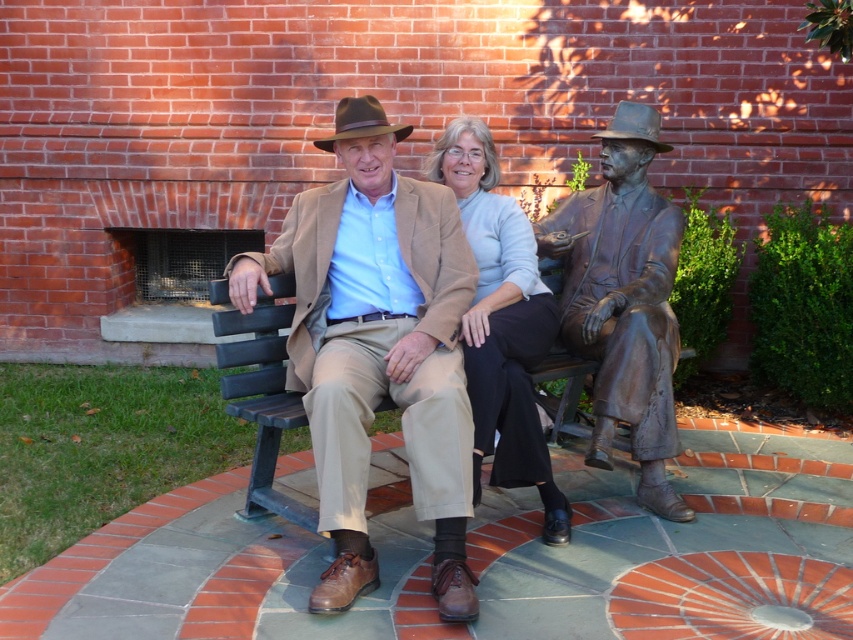
You are standing in front of the brick wall in the park scene. You want to place a small potted plant between the matte beige sweater at center and the shiny bronze cowboy hat at center. Which object should the plant be closer to?

The plant should be placed closer to the shiny bronze cowboy hat at center because the matte beige sweater at center is closer to the viewer, meaning the cowboy hat is farther back. Placing the plant closer to the hat would maintain the spatial relationship between the two objects.

You are standing in front of the bench in the park scene. There are two points marked on the image. One is at coordinate point [635,205] and the other is at point [265,396]. Which point is closer to you?

Point [635,205] is further to the camera than point [265,396], so the point closer to you is point [265,396].